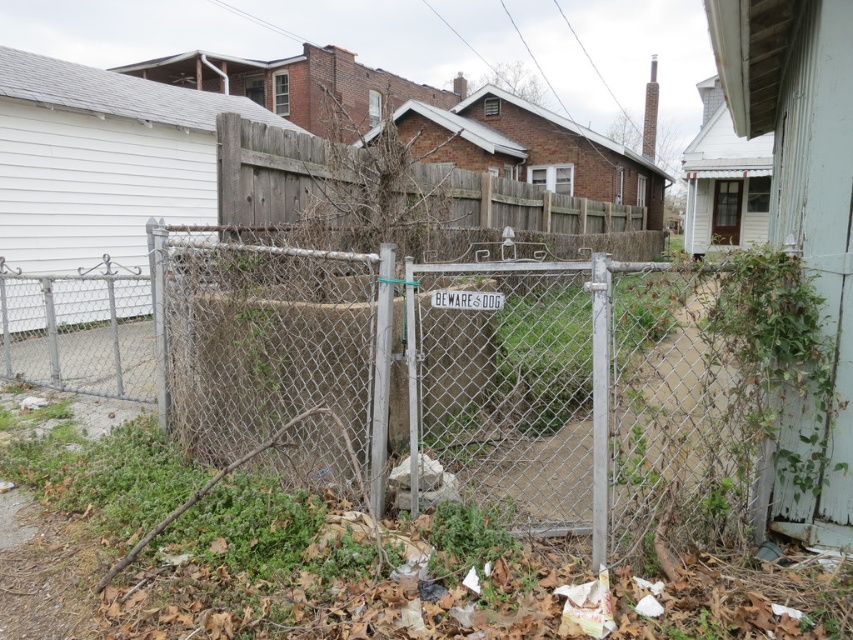
Describe the element at coordinates (466, 380) in the screenshot. I see `rusty chain-link fence at center` at that location.

Is point (537, 392) farther from viewer compared to point (735, 193)?

No, it is in front of (735, 193).

Where is `rusty chain-link fence at center`? Image resolution: width=853 pixels, height=640 pixels. rusty chain-link fence at center is located at coordinates (466, 380).

Can you confirm if rusty chain-link fence at center is positioned to the left of white plastic sign at center?

Correct, you'll find rusty chain-link fence at center to the left of white plastic sign at center.

Can you confirm if rusty chain-link fence at center is positioned below white plastic sign at center?

Yes.

Who is more distant from viewer, (718,352) or (432,298)?

The point (432,298) is more distant.

Find the location of a particular element. rusty chain-link fence at center is located at coordinates (466, 380).

Between white wood door at upper right and white plastic sign at center, which one is positioned higher?

white wood door at upper right is higher up.

Between white wood door at upper right and white plastic sign at center, which one is positioned lower?

white plastic sign at center

Between point (730, 209) and point (459, 289), which one is positioned behind?

The point (730, 209) is behind.

I want to click on white wood door at upper right, so click(x=726, y=211).